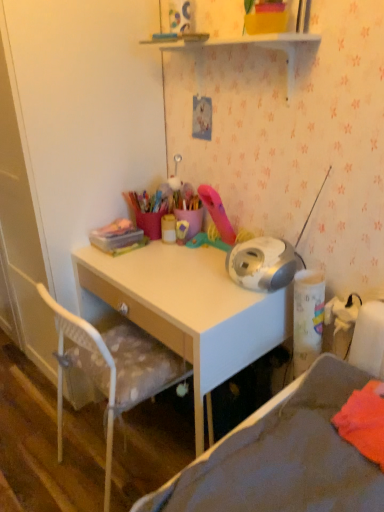
Identify the location of free spot above light wood desk at center (from a real-world perspective). (164, 263).